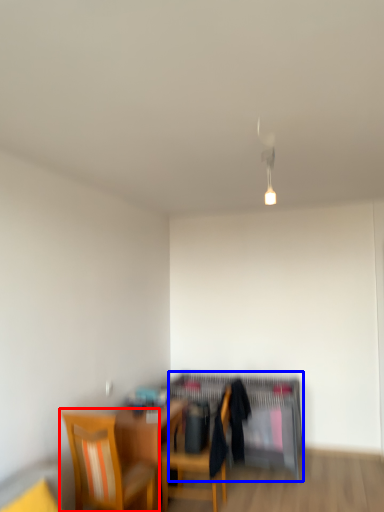
Question: Which object appears farthest to the camera in this image, chair (highlighted by a red box) or computer desk (highlighted by a blue box)?

Choices:
 (A) chair
 (B) computer desk

Answer: (B)